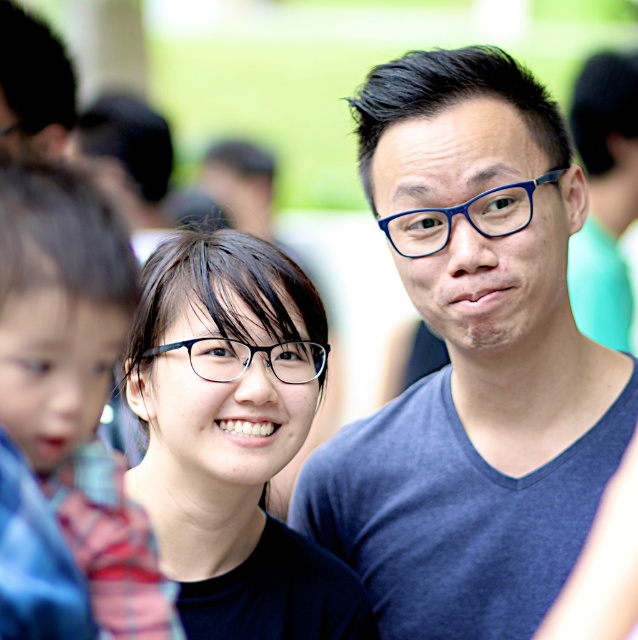
Question: Based on their relative distances, which object is nearer to the clear plastic glasses at center?

Choices:
 (A) blue matte shirt at center
 (B) plaid fabric shirt at left

Answer: (A)

Question: Does plaid fabric shirt at left appear under blue plastic glasses at center?

Choices:
 (A) yes
 (B) no

Answer: (A)

Question: Is blue matte shirt at center smaller than blue plastic glasses at center?

Choices:
 (A) no
 (B) yes

Answer: (A)

Question: Does black matte glasses at center appear over clear plastic glasses at center?

Choices:
 (A) yes
 (B) no

Answer: (B)

Question: Which point is closer to the camera?

Choices:
 (A) blue plastic glasses at center
 (B) black matte glasses at center
 (C) clear plastic glasses at center
 (D) plaid fabric shirt at left

Answer: (D)

Question: Among these objects, which one is farthest from the camera?

Choices:
 (A) black matte glasses at center
 (B) blue matte shirt at center
 (C) blue plastic glasses at center

Answer: (B)